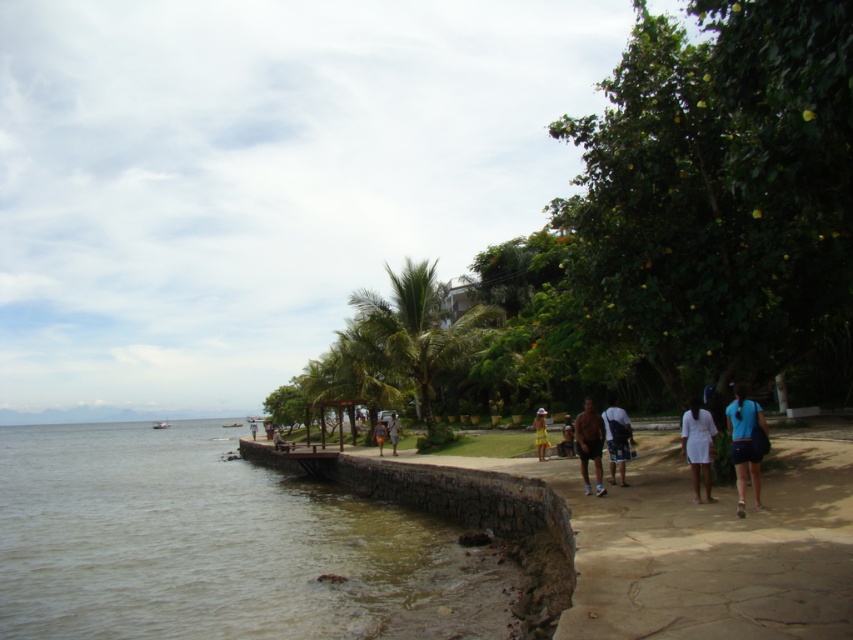
Question: Which of the following is the closest to the observer?

Choices:
 (A) (254, 428)
 (B) (601, 467)

Answer: (B)

Question: Estimate the real-world distances between objects in this image. Which object is closer to the blue fabric shorts at lower right?

Choices:
 (A) dark blue shorts at center
 (B) light brown wooden bench at center

Answer: (A)

Question: Is white matte dress at lower right above light brown wooden bench at center?

Choices:
 (A) yes
 (B) no

Answer: (A)

Question: Is white matte dress at lower right thinner than brown skin at center?

Choices:
 (A) yes
 (B) no

Answer: (A)

Question: Observing the image, what is the correct spatial positioning of brown skin at center in reference to light brown wooden bench at center?

Choices:
 (A) above
 (B) below

Answer: (A)

Question: Which object is farther from the camera taking this photo?

Choices:
 (A) tan fabric shorts at center
 (B) green leafy palm tree at center
 (C) blue fabric shorts at lower right

Answer: (A)